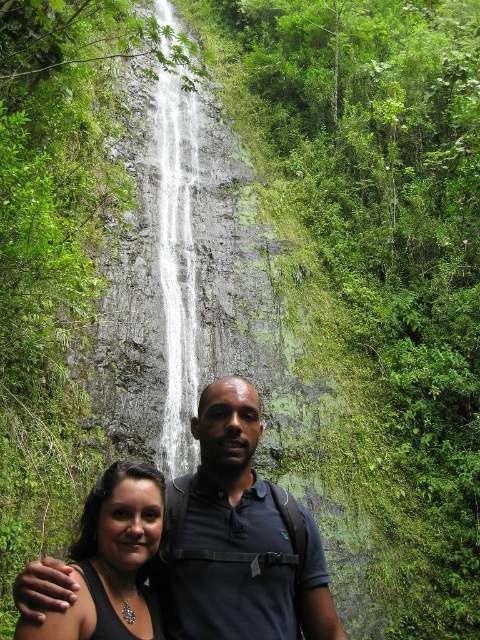
The width and height of the screenshot is (480, 640). What do you see at coordinates (239, 538) in the screenshot?
I see `dark blue shirt at center` at bounding box center [239, 538].

How much distance is there between dark blue shirt at center and shiny silver necklace at lower left?

dark blue shirt at center is 6.50 meters away from shiny silver necklace at lower left.

Describe the element at coordinates (239, 538) in the screenshot. The height and width of the screenshot is (640, 480). I see `dark blue shirt at center` at that location.

I want to click on dark blue shirt at center, so click(x=239, y=538).

Is dark blue shirt at center above gray stone waterfall at center?

No.

Which of these two, dark blue shirt at center or gray stone waterfall at center, stands taller?

Standing taller between the two is gray stone waterfall at center.

In order to click on dark blue shirt at center in this screenshot , I will do `click(239, 538)`.

Does gray stone waterfall at center have a lesser width compared to shiny silver necklace at lower left?

No, gray stone waterfall at center is not thinner than shiny silver necklace at lower left.

Can you confirm if gray stone waterfall at center is shorter than shiny silver necklace at lower left?

Incorrect, gray stone waterfall at center's height does not fall short of shiny silver necklace at lower left's.

Is point (163, 88) less distant than point (127, 579)?

No, it is behind (127, 579).

Locate an element on the screen. gray stone waterfall at center is located at coordinates (177, 264).